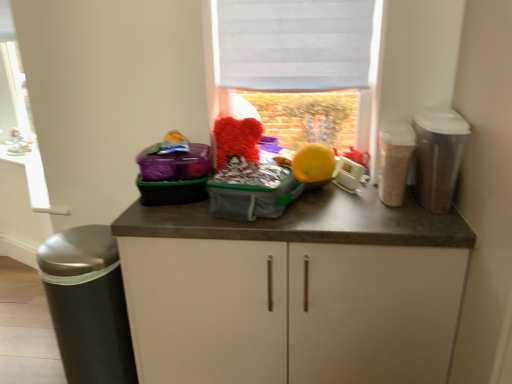
Question: Considering the positions of plastic gray bag at center and white fabric at upper center in the image, is plastic gray bag at center wider or thinner than white fabric at upper center?

Choices:
 (A) wide
 (B) thin

Answer: (A)

Question: Considering the positions of point (230, 216) and point (238, 21), is point (230, 216) closer or farther from the camera than point (238, 21)?

Choices:
 (A) farther
 (B) closer

Answer: (B)

Question: Which object is positioned closest to the translucent plastic canister at right, the third appliance in the left-to-right sequence?

Choices:
 (A) white plastic toaster at center, arranged as the 3th appliance when viewed from the right
 (B) white fabric at upper center
 (C) porcelain figurine at left
 (D) white fabric blind at upper center
 (E) plastic gray bag at center

Answer: (A)

Question: Considering the real-world distances, which object is farthest from the plastic gray bag at center?

Choices:
 (A) white plastic window frame at left
 (B) porcelain figurine at left
 (C) white plastic toaster at center, arranged as the 3th appliance when viewed from the right
 (D) fluffy red teddy bear at center
 (E) white matte cabinet at center

Answer: (B)